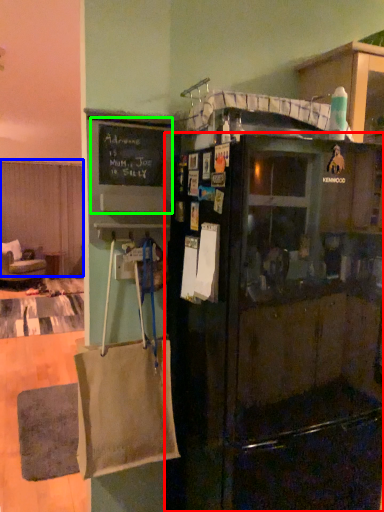
Question: Considering the real-world distances, which object is farthest from refrigerator (highlighted by a red box)? curtain (highlighted by a blue box) or bulletin board (highlighted by a green box)?

Choices:
 (A) curtain
 (B) bulletin board

Answer: (A)